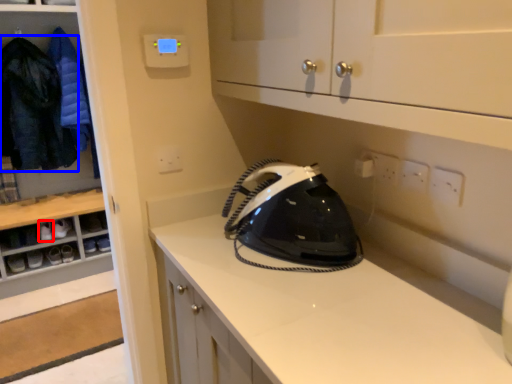
Question: Which object appears farthest to the camera in this image, footwear (highlighted by a red box) or clothing (highlighted by a blue box)?

Choices:
 (A) footwear
 (B) clothing

Answer: (A)